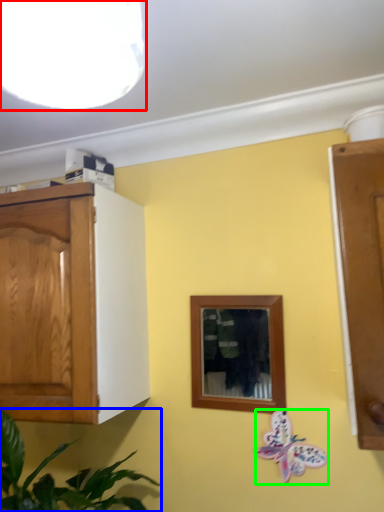
Question: Based on their relative distances, which object is nearer to light fixture (highlighted by a red box)? Choose from houseplant (highlighted by a blue box) and butterfly (highlighted by a green box).

Choices:
 (A) houseplant
 (B) butterfly

Answer: (A)